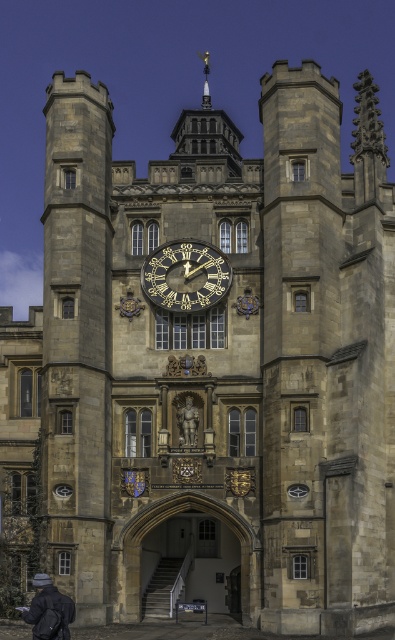
You are an architect examining the historic stone building. You notice the gold metallic clock at center and the polished bronze statue at center. Which object is located higher up in the building?

The gold metallic clock at center is positioned over the polished bronze statue at center, so it is higher up.

You are an architect analyzing the facade of a historic building. You notice the gold metallic clock at center and the dark gray knit hat at lower left. Which object takes up more area on the facade?

The dark gray knit hat at lower left takes up more area on the facade than the gold metallic clock at center because the gold metallic clock at center occupies less space than dark gray knit hat at lower left.

You are standing in front of the historic stone building and want to take a photo that includes both the point at coordinates point(191, 275) and point(33, 621). Which point will appear closer to the bottom of the photo?

Point(33, 621) will appear closer to the bottom of the photo because it is closer to the camera than point(191, 275).